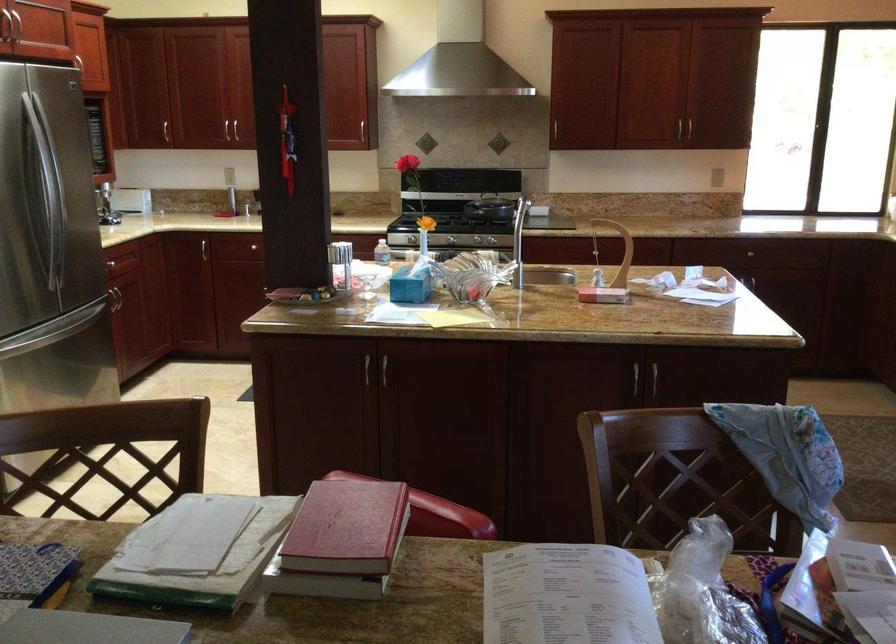
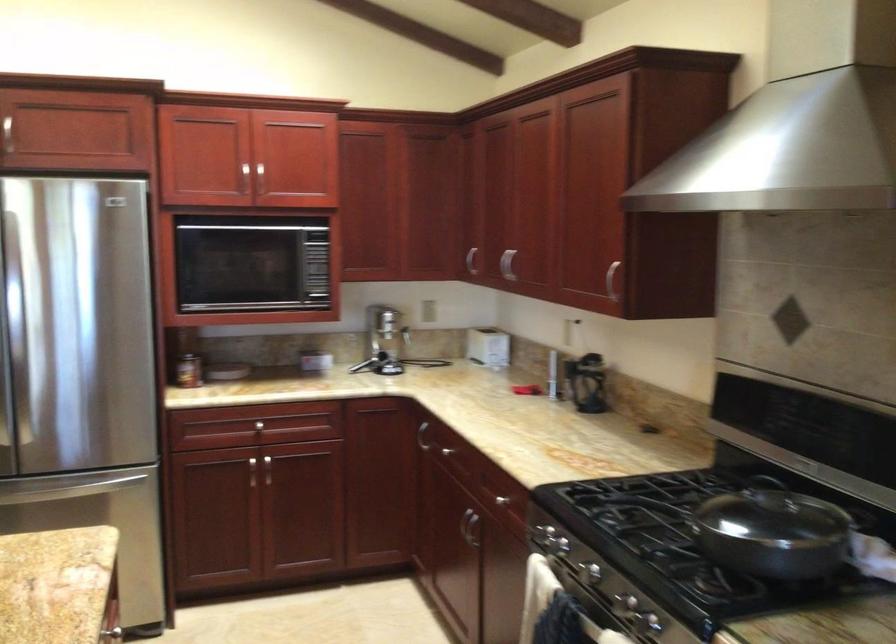
The point at (470,193) is marked in the first image. Where is the corresponding point in the second image?

(800, 545)